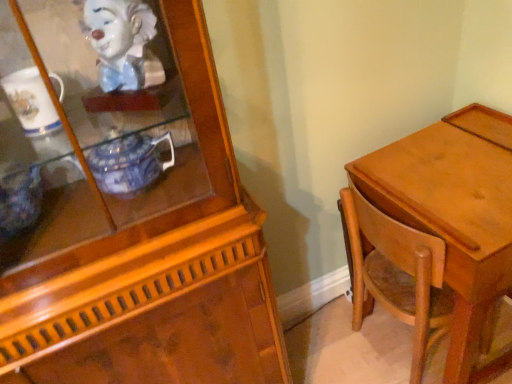
Identify the location of vacant area on top of wooden chair at right (from a real-world perspective). (417, 191).